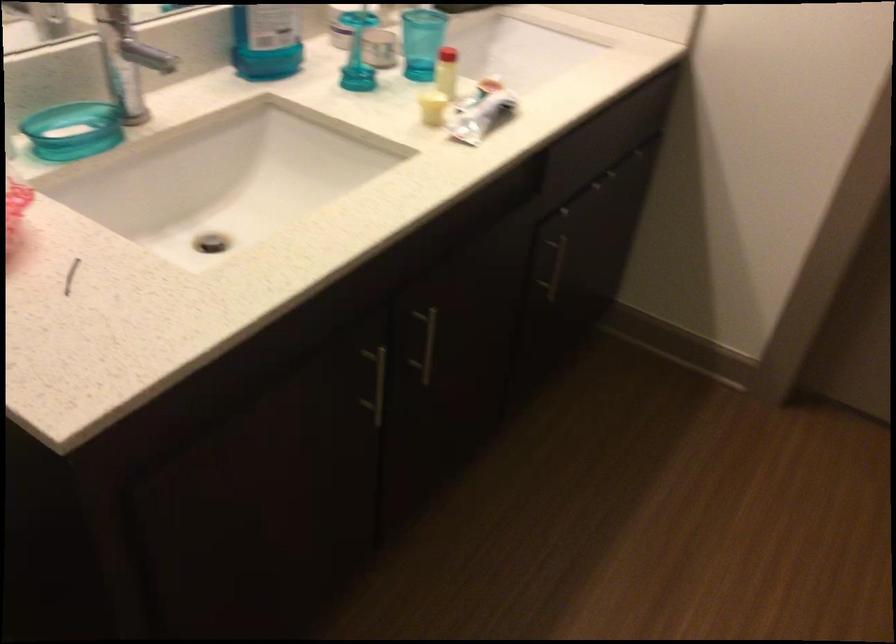
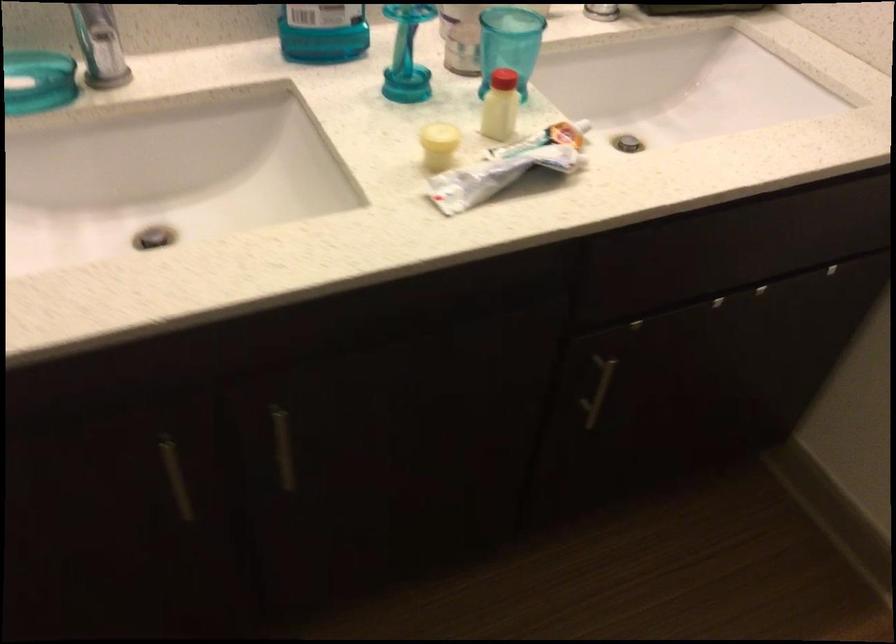
The point at (446, 76) is marked in the first image. Where is the corresponding point in the second image?

(501, 106)